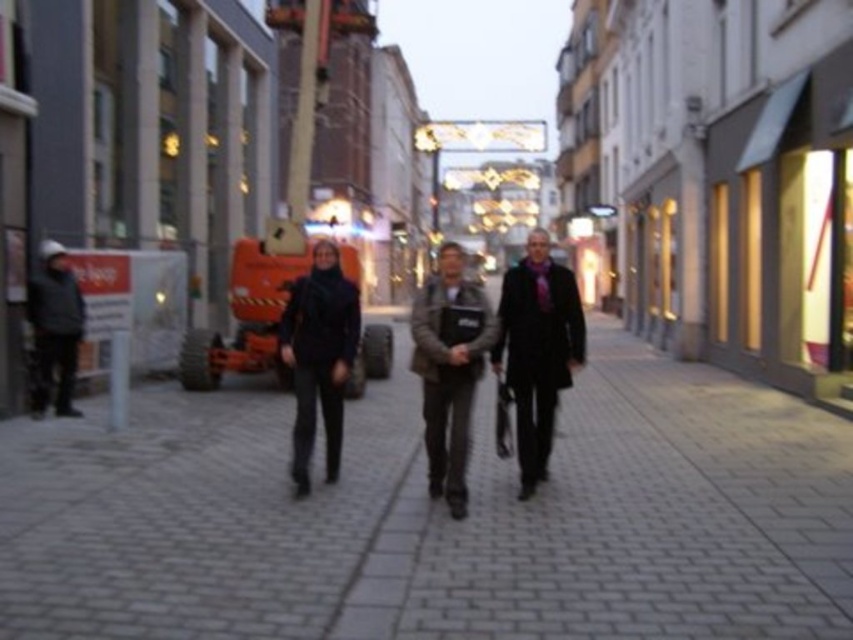
You are a delivery person who needs to pass between the dark brown leather jacket at center and the black wool coat at center to reach the sidewalk. The delivery cart you are pushing is 80 centimeters wide. Will you be able to fit through the space between them?

The distance between the dark brown leather jacket at center and the black wool coat at center is 79.67 centimeters. Since the delivery cart is 80 centimeters wide, it is slightly too wide to fit through the space between them.

You are a fashion designer observing the two coats worn by people in the scene. Which of the two coats, the dark brown leather jacket at center or the black wool coat at center, is shorter in length?

The dark brown leather jacket at center has a lesser height compared to the black wool coat at center, so the dark brown leather jacket at center is shorter in length.

You are a fashion photographer who wants to capture the black wool coat at center and brown leather jacket at center in a single frame. Based on their positions, which one is positioned to the right side of the other?

The black wool coat at center is to the right of the brown leather jacket at center.